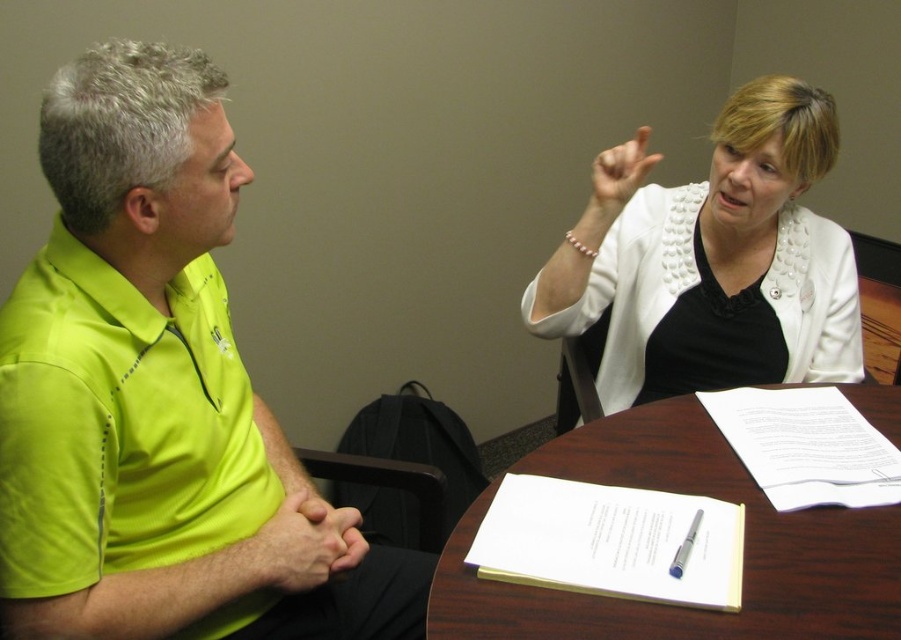
Question: Does neon yellow shirt at left lie in front of metallic silver pen at table center?

Choices:
 (A) no
 (B) yes

Answer: (B)

Question: Which object appears farthest from the camera in this image?

Choices:
 (A) white textured blazer at upper right
 (B) wooden table at lower right

Answer: (A)

Question: Does yellow matte/gloved hand at lower left have a larger size compared to white matte hand at upper right?

Choices:
 (A) no
 (B) yes

Answer: (A)

Question: Which point is farther to the camera?

Choices:
 (A) white textured blazer at upper right
 (B) neon yellow polyester polo shirt at left
 (C) white matte hand at upper right
 (D) wooden table at lower right

Answer: (A)

Question: Among these points, which one is nearest to the camera?

Choices:
 (A) (617, 148)
 (B) (854, 573)
 (C) (792, 166)
 (D) (317, 518)

Answer: (B)

Question: Is yellow matte/gloved hand at lower left positioned in front of metallic silver pen at table center?

Choices:
 (A) no
 (B) yes

Answer: (A)